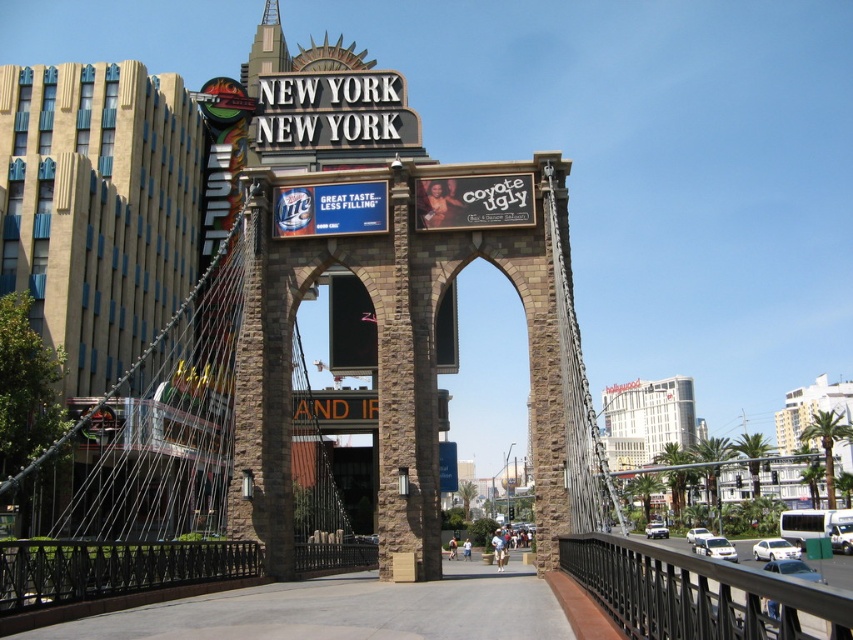
You are standing in front of the New York New York hotel and casino in Las Vegas, looking at the bridge entrance structure. There are two points marked on the structure. The first point is at coordinates point [317,145] and the second is at point [686,536]. If you were to touch both points with a long pole, which point would you reach first?

Point [317,145] is closer to the viewer than point [686,536], so you would reach point [317,145] first with the pole.

Consider the image. You are driving a car that is 1.8 meters wide. You see the white metallic sign at upper center and the white glossy car at center in the image. Can your car fit through the space between the two objects?

The white metallic sign at upper center might be wider than the white glossy car at center, so there is uncertainty about the exact width of the space between them. Without precise measurements, it is not possible to determine if your car, which is 1.8 meters wide, can fit through the space between the two objects.